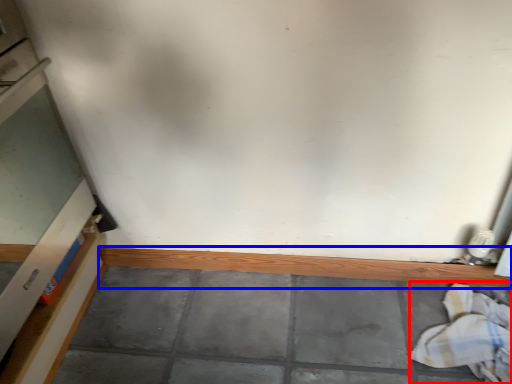
Question: Which of the following is the farthest to the observer, laundry (highlighted by a red box) or ledge (highlighted by a blue box)?

Choices:
 (A) laundry
 (B) ledge

Answer: (B)